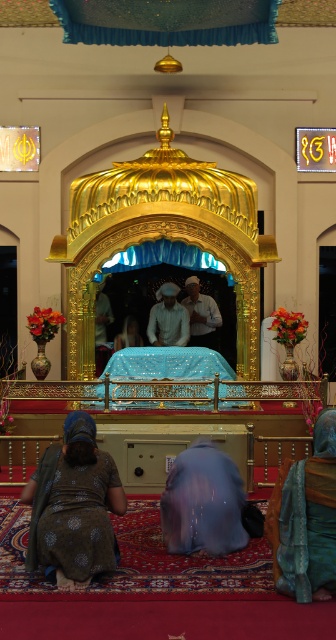
You are visiting the Gurdwara and notice two robes in the scene. The teal fabric robe at lower right and the white cotton robe at center. Which robe is positioned to the right of the other?

The teal fabric robe at lower right is positioned to the right of the white cotton robe at center.

You are a visitor entering the Gurdwara and see the dark brown fabric at lower left and the blue satin robe at center. According to the scene, which object is positioned higher from the ground?

The dark brown fabric at lower left is located above the blue satin robe at center, so it is positioned higher from the ground.